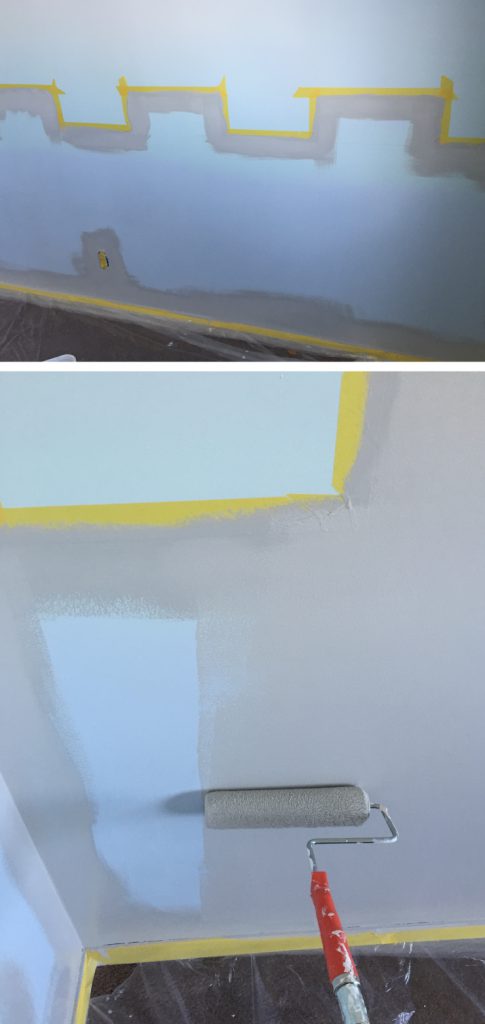
At what (x,y) coordinates should I click in order to perform the action: click on plastic floor covering. Please return your answer as a coordinate pair (x, y). This screenshot has height=1024, width=485. Looking at the image, I should click on (147, 1000).